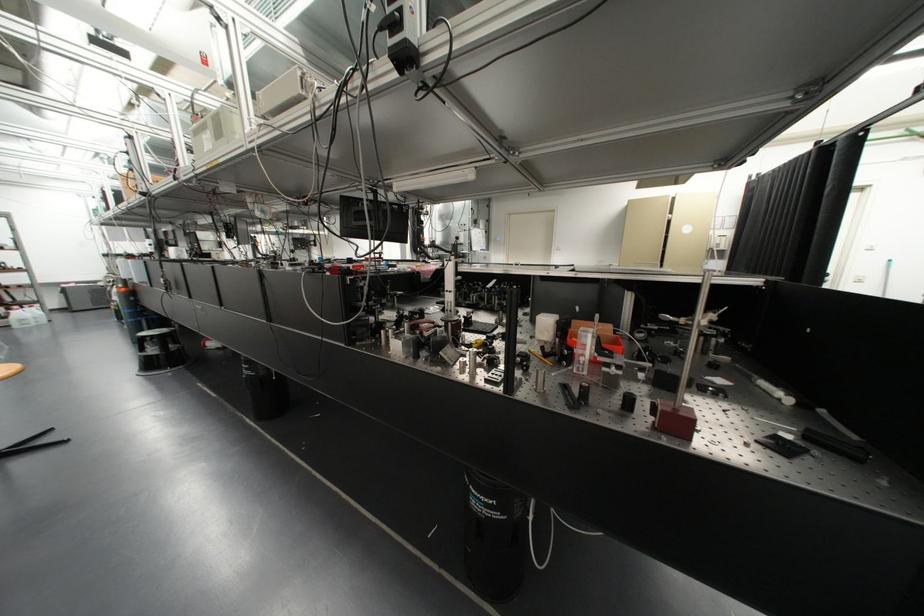
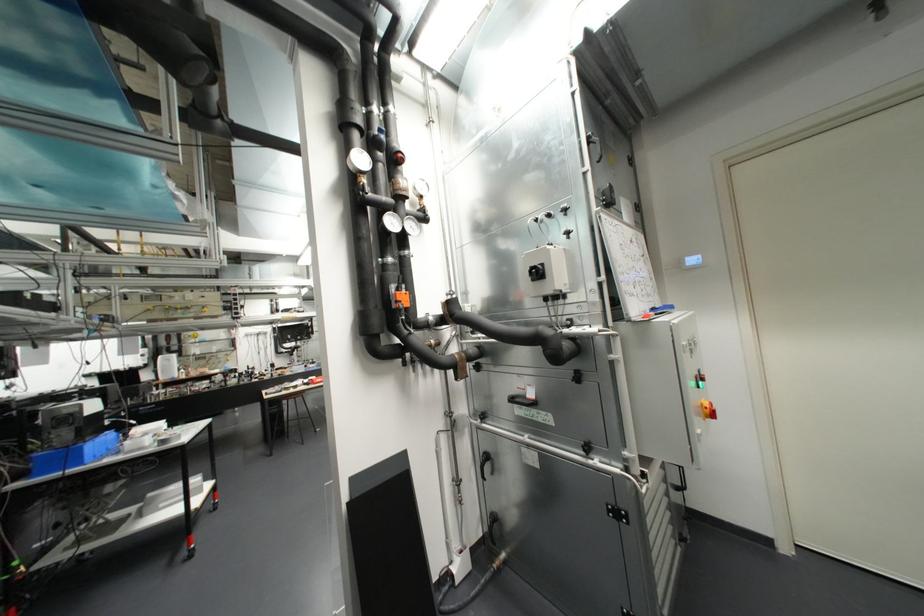
Question: In a continuous first-person perspective shot, in which direction is the camera moving?

Choices:
 (A) Left
 (B) Right
 (C) Forward
 (D) Backward

Answer: (C)